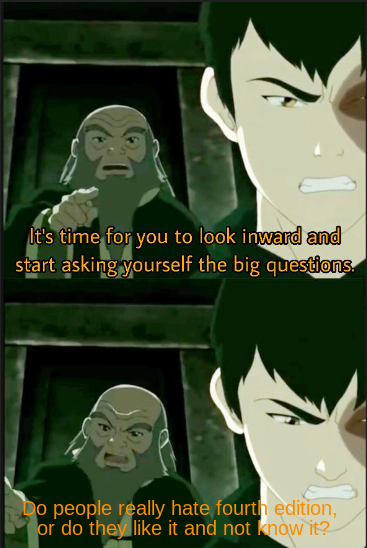
Locate an element on the screen. This screenshot has width=367, height=548. archway is located at coordinates (95, 335), (126, 38).